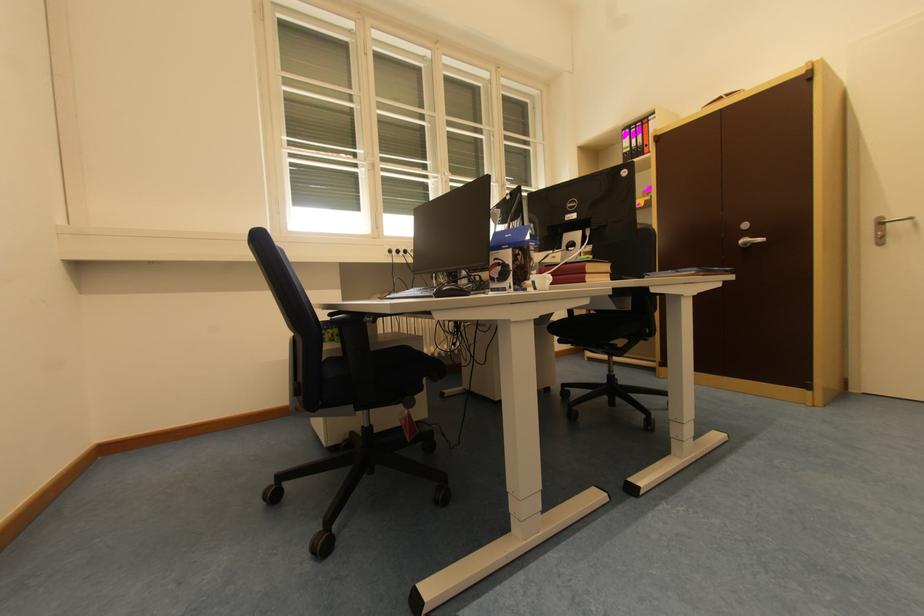
Image resolution: width=924 pixels, height=616 pixels. I want to click on blue chair sitting surface, so click(x=375, y=374).